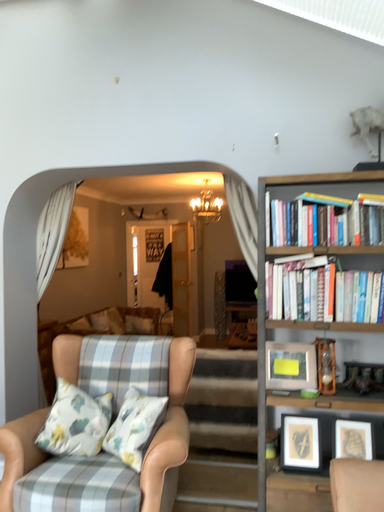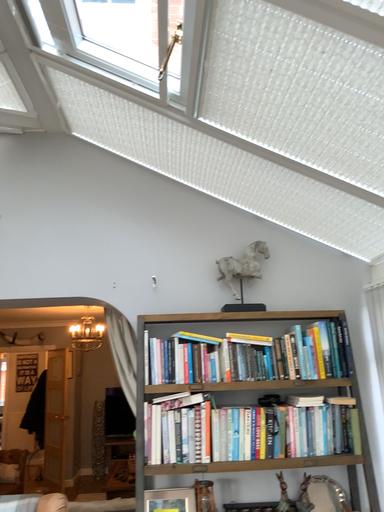
Question: Which way did the camera rotate in the video?

Choices:
 (A) rotated right
 (B) rotated left

Answer: (A)